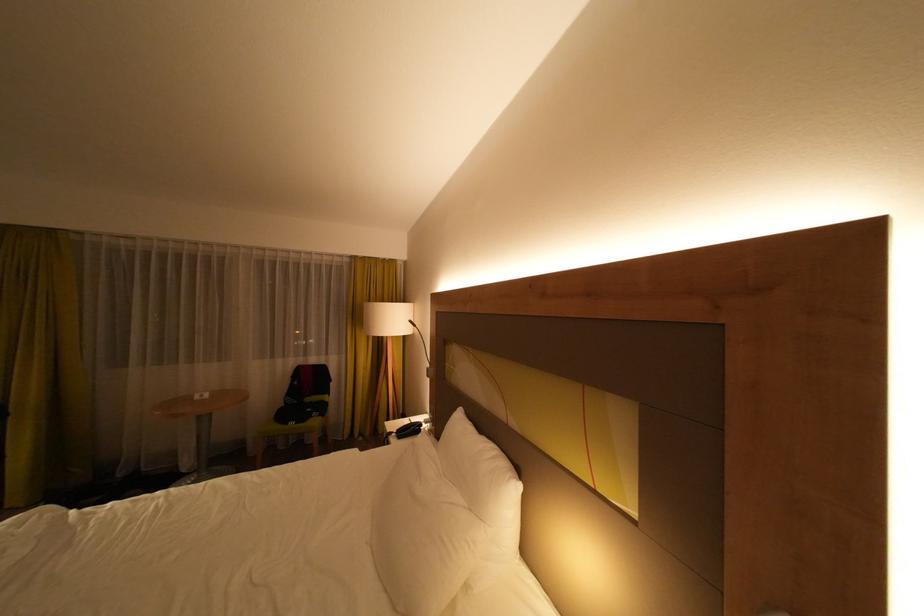
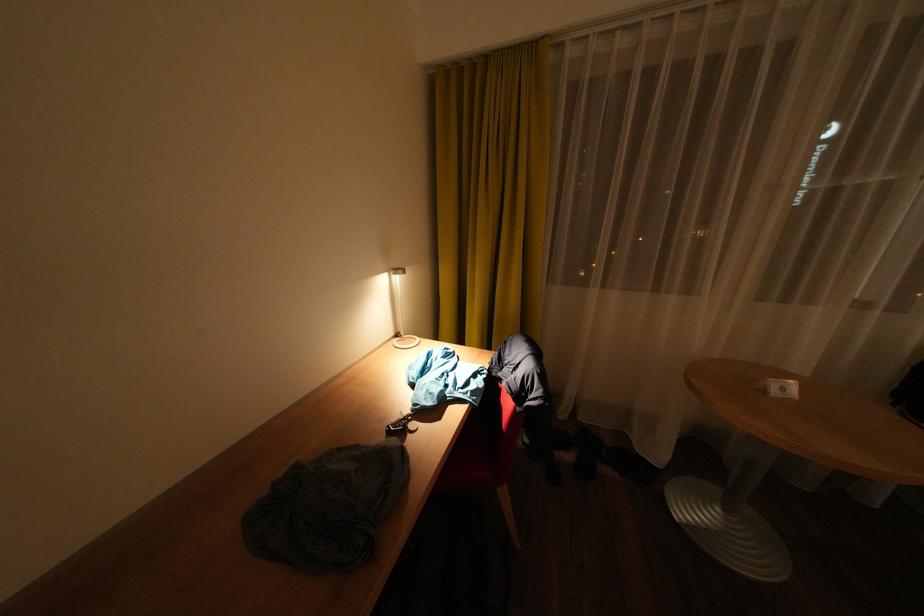
Where in the second image is the point corresponding to (62,233) from the first image?

(544, 47)